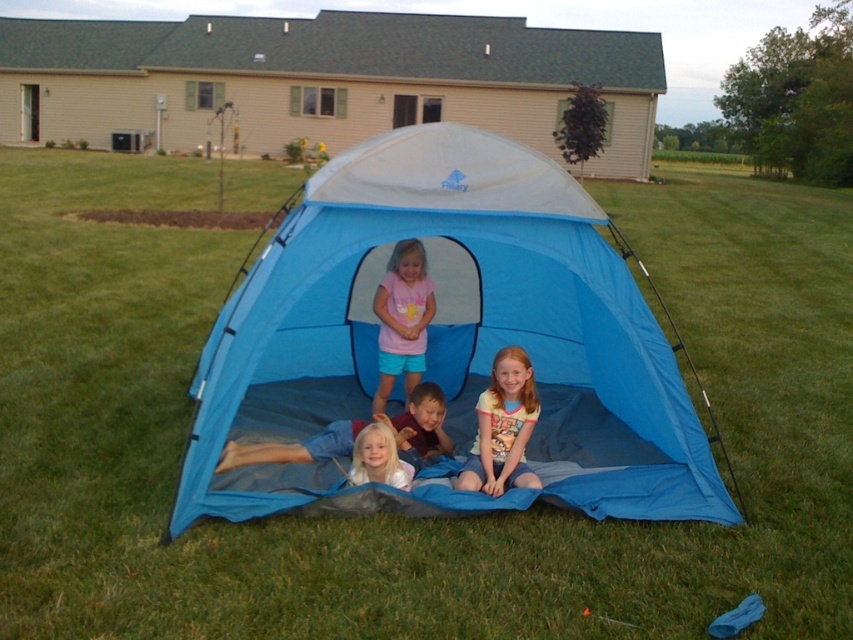
Between light pink cotton shirt at center and blonde hair at center, which one has less height?

blonde hair at center

Is point (506, 452) more distant than point (386, 428)?

Yes, it is behind point (386, 428).

Identify the location of light pink cotton shirt at center. This screenshot has width=853, height=640. (502, 428).

Is light pink cotton shirt at center shorter than pink matte shirt at center?

Yes.

Between light pink cotton shirt at center and pink matte shirt at center, which one appears on the right side from the viewer's perspective?

light pink cotton shirt at center is more to the right.

From the picture: Who is more distant from viewer, (477, 448) or (413, 240)?

The point (477, 448) is more distant.

Where is `light pink cotton shirt at center`? The width and height of the screenshot is (853, 640). light pink cotton shirt at center is located at coordinates (502, 428).

Which is below, pink matte shirt at center or blonde hair at center?

blonde hair at center

In the scene shown: Does pink matte shirt at center come behind blonde hair at center?

Yes, it is behind blonde hair at center.

Is point (419, 378) positioned before point (361, 445)?

No.

Identify the location of pink matte shirt at center. This screenshot has width=853, height=640. (402, 317).